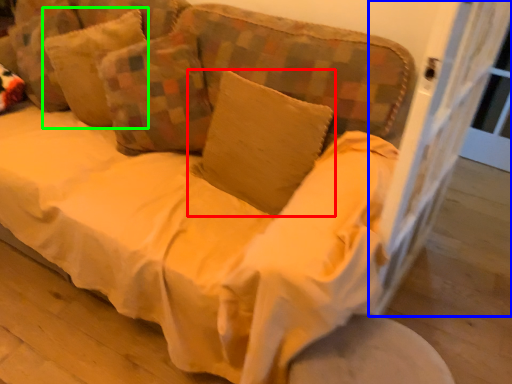
Question: Which is farther away from pillow (highlighted by a red box)? screen door (highlighted by a blue box) or pillow (highlighted by a green box)?

Choices:
 (A) screen door
 (B) pillow

Answer: (B)